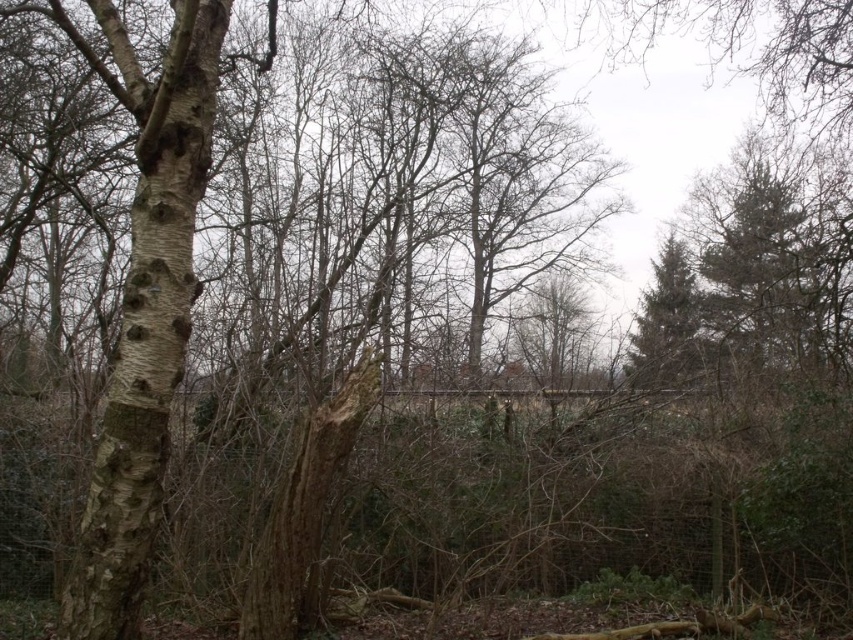
Question: Which point appears closest to the camera in this image?

Choices:
 (A) (195, 120)
 (B) (641, 320)

Answer: (A)

Question: Does barky white birch tree at left have a greater width compared to green textured pine tree at right?

Choices:
 (A) yes
 (B) no

Answer: (A)

Question: Can you confirm if barky white birch tree at left is positioned below green textured pine tree at right?

Choices:
 (A) no
 (B) yes

Answer: (A)

Question: Which point is farther to the camera?

Choices:
 (A) (70, 611)
 (B) (677, 262)

Answer: (B)

Question: Is barky white birch tree at left smaller than green textured pine tree at right?

Choices:
 (A) yes
 (B) no

Answer: (B)